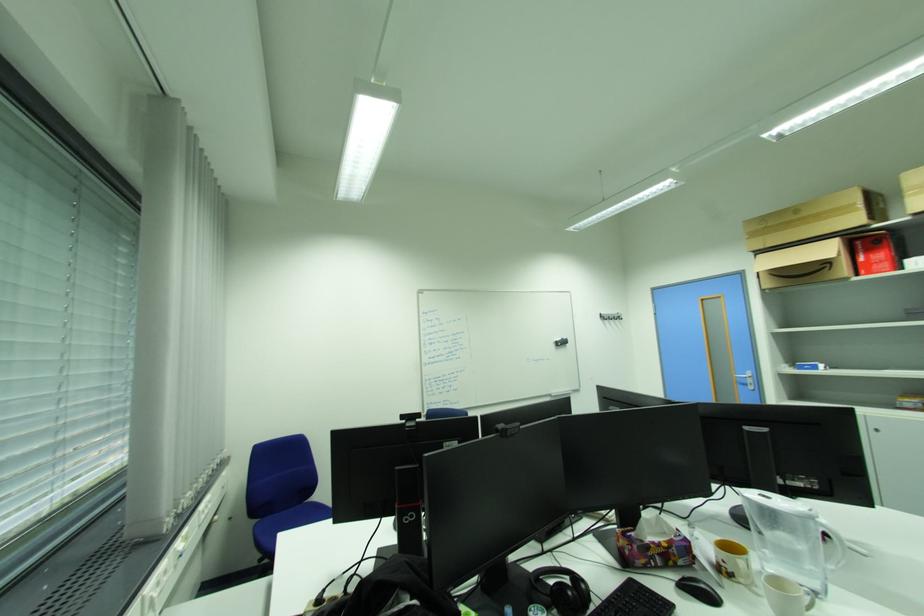
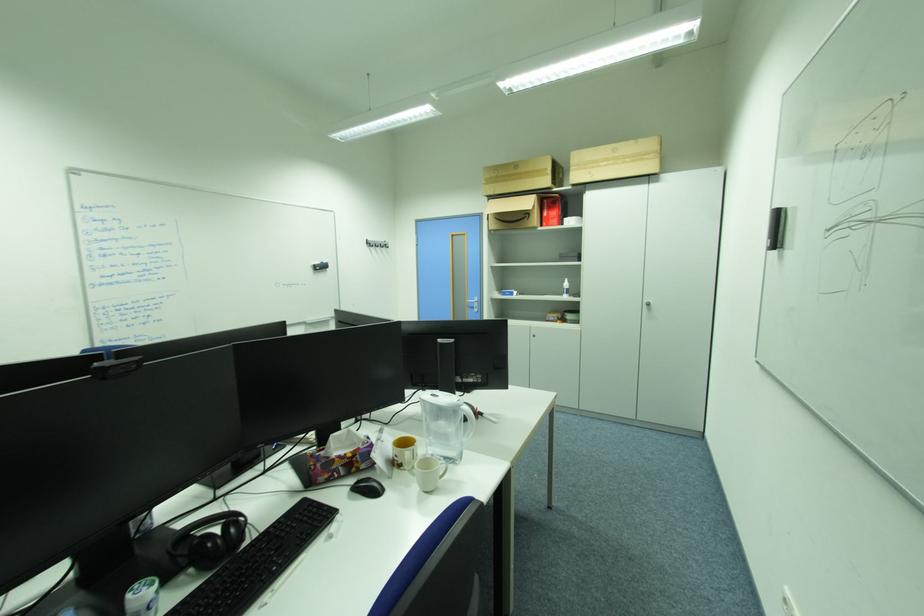
Question: Based on the continuous images, in which direction is the camera rotating? Reply with the corresponding letter.

Choices:
 (A) Left
 (B) Right
 (C) Up
 (D) Down

Answer: (B)